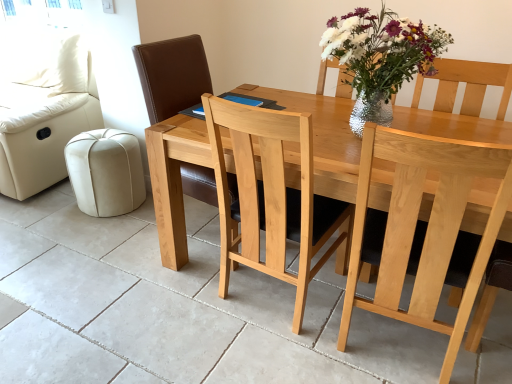
Where is `free point in front of natural wood chair at center, the first chair positioned from the left`? This screenshot has height=384, width=512. free point in front of natural wood chair at center, the first chair positioned from the left is located at coordinates 185,311.